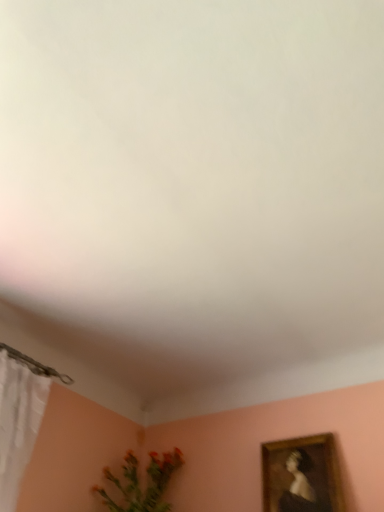
Identify the location of wooden framed portrait at lower right. The image size is (384, 512). (302, 475).

Describe the element at coordinates (302, 475) in the screenshot. I see `wooden framed portrait at lower right` at that location.

You are a GUI agent. You are given a task and a screenshot of the screen. Output one action in this format:
    pyautogui.click(x=<x>, y=<y>)
    Task: Click on the wooden framed portrait at lower right
    This screenshot has width=384, height=512.
    Given the screenshot: What is the action you would take?
    pyautogui.click(x=302, y=475)